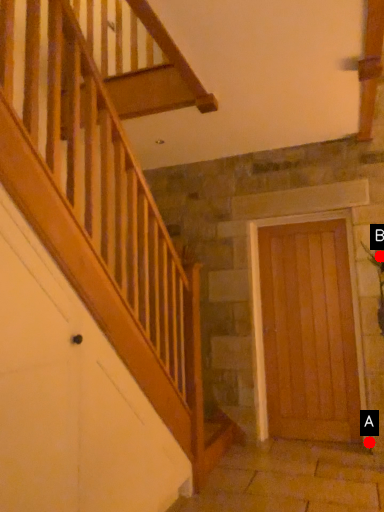
Question: Two points are circled on the image, labeled by A and B beside each circle. Which point is farther from the camera taking this photo?

Choices:
 (A) A is further
 (B) B is further

Answer: (B)